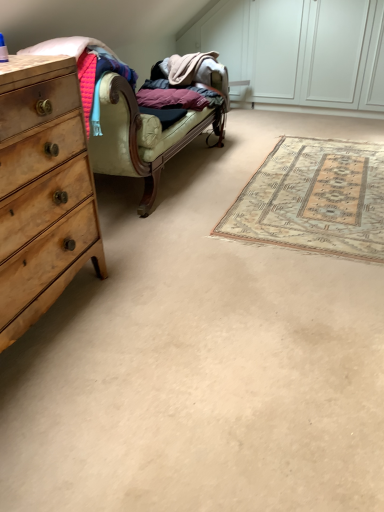
Question: In terms of height, does wooden chest of drawers at left look taller or shorter compared to beige woven rug at center?

Choices:
 (A) short
 (B) tall

Answer: (B)

Question: From a real-world perspective, is wooden chest of drawers at left physically located above or below beige woven rug at center?

Choices:
 (A) below
 (B) above

Answer: (B)

Question: Which object is positioned closest to the beige woven rug at center?

Choices:
 (A) velvet green couch at center
 (B) wooden chest of drawers at left

Answer: (A)

Question: Which object is the closest to the velvet green couch at center?

Choices:
 (A) wooden chest of drawers at left
 (B) beige woven rug at center

Answer: (B)